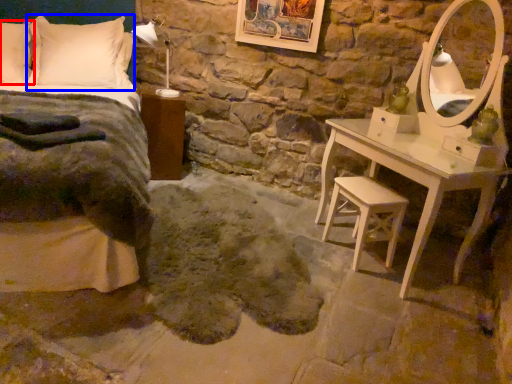
Question: Among these objects, which one is farthest to the camera, pillow (highlighted by a red box) or pillow (highlighted by a blue box)?

Choices:
 (A) pillow
 (B) pillow

Answer: (B)